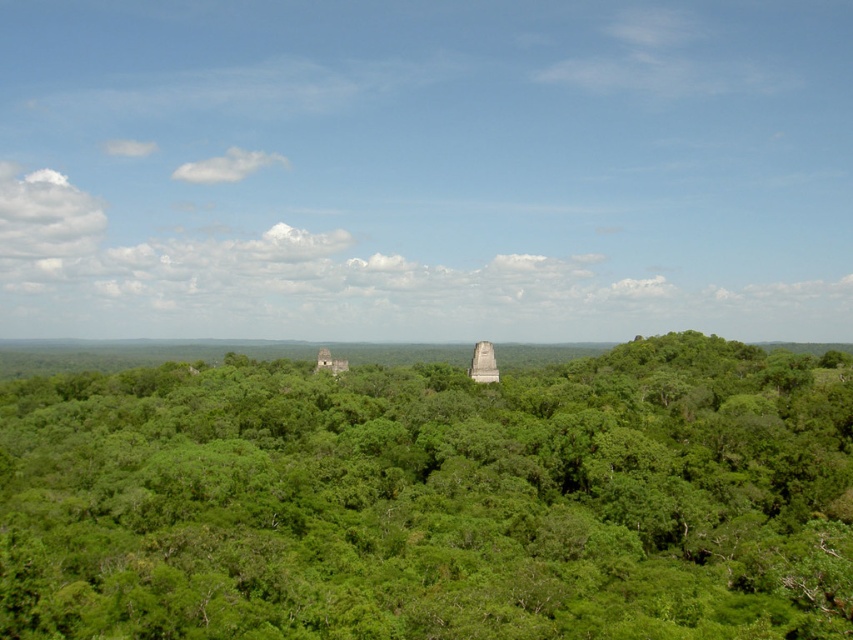
Consider the image. You are a photographer standing in the jungle, and you want to capture a photo of the point at coordinates (294,477). The camera you are using has a focal length of 50mm. Can you estimate how far you need to move forward or backward to focus on that point?

The point at coordinates (294,477) is 123.28 meters away from the camera. To focus on it, you would need to adjust your camera settings or physically move closer or farther based on the camera lens capabilities. However, since the distance is already set at 123.28 meters, the camera should be focused at that distance to capture the point clearly.

What are the coordinates of the green leafy trees at center?

The green leafy trees at center are located at coordinates point (x=433, y=499).

From the picture: You are an explorer in the jungle and want to reach the green leafy trees at center. You have a 100 feet long rope. Can you use the rope to reach them without walking through the dense undergrowth?

The green leafy trees at center is 153.94 feet away from camera. Since the rope is only 100 feet long, it is not long enough to reach them. You would need a longer rope or another method to get there.